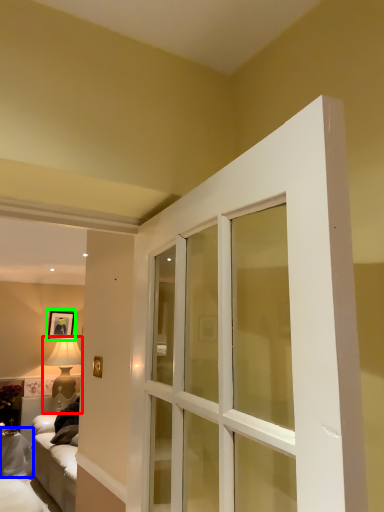
Question: Which object is positioned farthest from lamp (highlighted by a red box)? Select from furniture (highlighted by a blue box) and picture frame (highlighted by a green box).

Choices:
 (A) furniture
 (B) picture frame

Answer: (A)